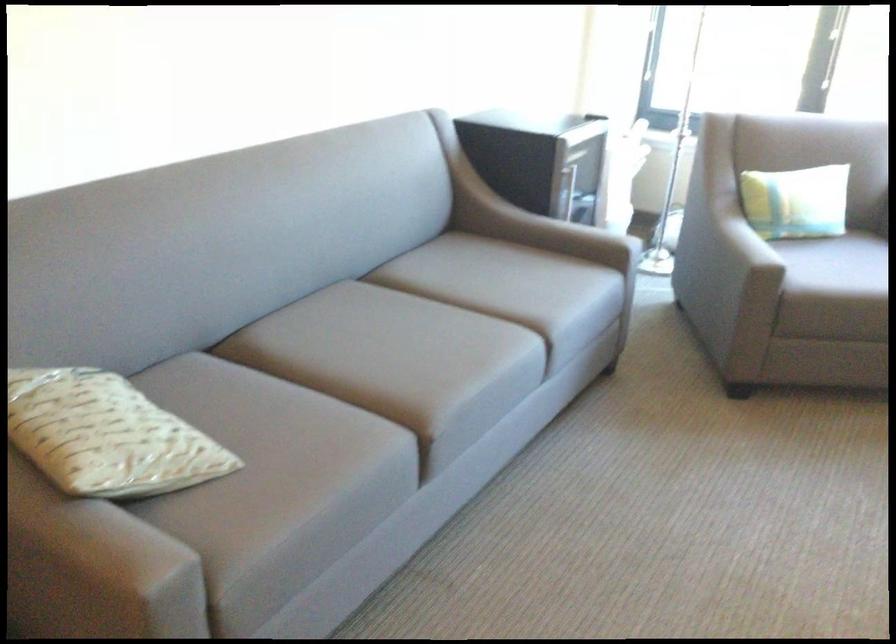
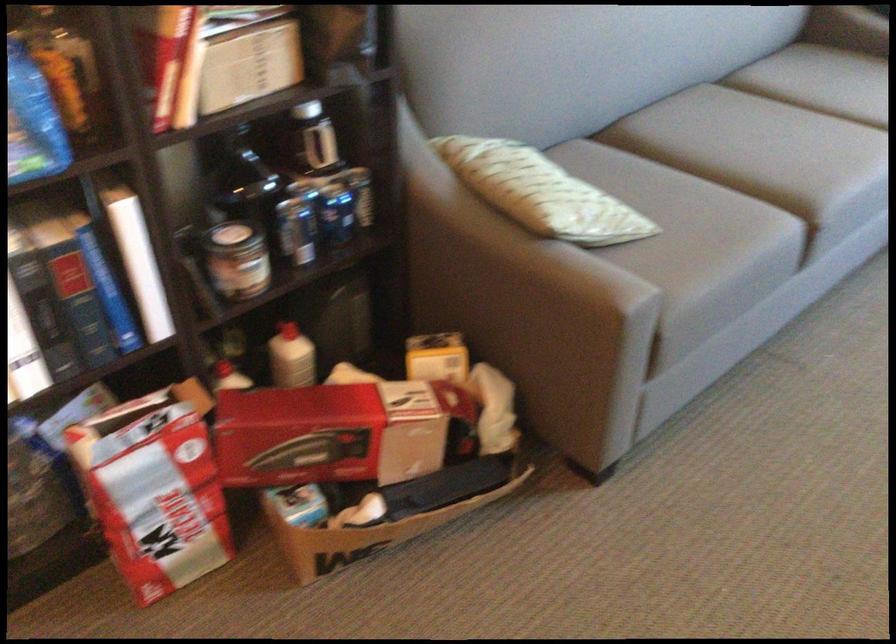
In the second image, find the point that corresponds to (x=384, y=355) in the first image.

(760, 147)